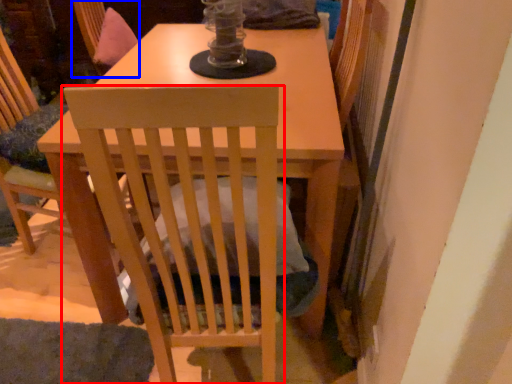
Question: Among these objects, which one is nearest to the camera, chair (highlighted by a red box) or swivel chair (highlighted by a blue box)?

Choices:
 (A) chair
 (B) swivel chair

Answer: (A)